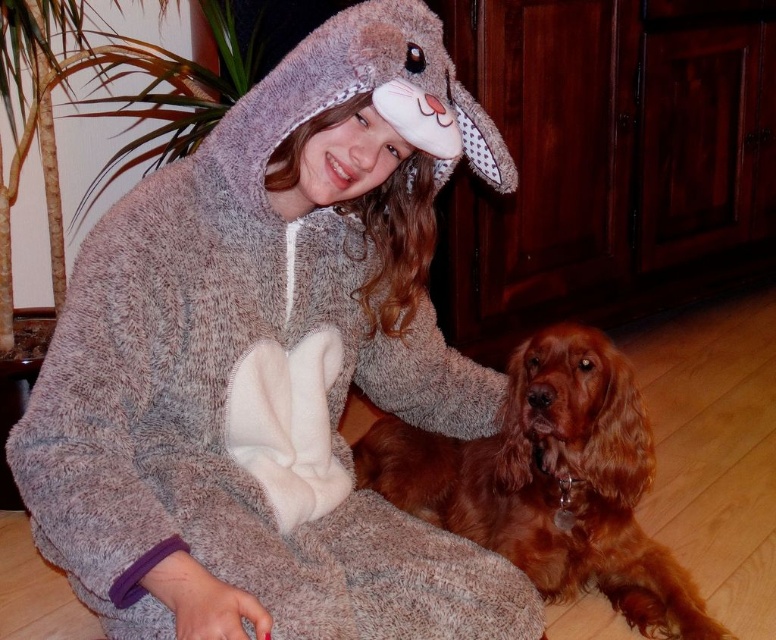
Question: Which point is farther to the camera?

Choices:
 (A) fluffy gray onesie at center
 (B) brown furry dog at lower right

Answer: (B)

Question: Can you confirm if fluffy gray onesie at center is bigger than brown furry dog at lower right?

Choices:
 (A) yes
 (B) no

Answer: (A)

Question: Which of the following is the closest to the observer?

Choices:
 (A) brown furry dog at lower right
 (B) fluffy gray onesie at center

Answer: (B)

Question: Does fluffy gray onesie at center appear under brown furry dog at lower right?

Choices:
 (A) no
 (B) yes

Answer: (A)

Question: Does fluffy gray onesie at center appear under brown furry dog at lower right?

Choices:
 (A) yes
 (B) no

Answer: (B)